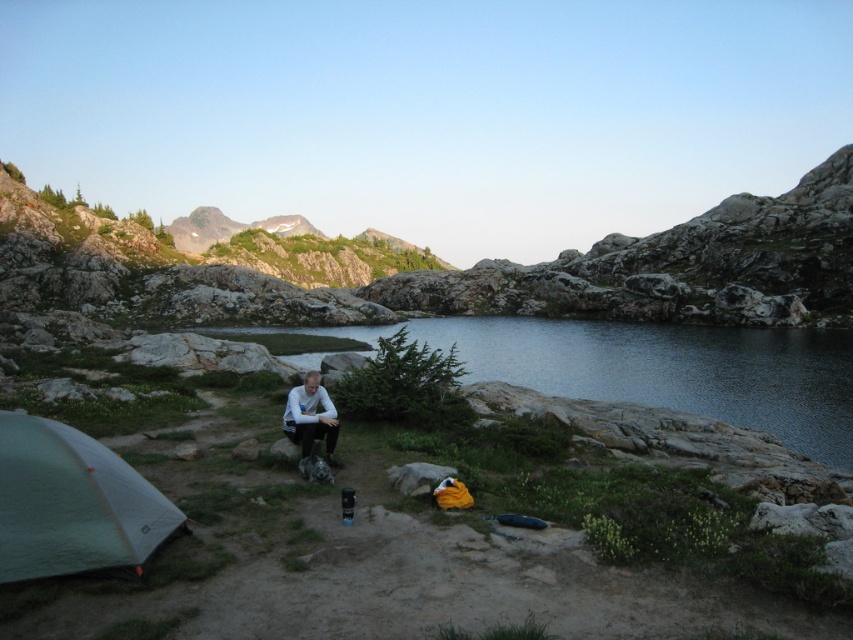
You are a hiker who needs to refill your water bottle. You see the clear water at center and the green fabric tent at lower left. Which one is located to the right of the other?

The clear water at center is to the right of the green fabric tent at lower left.

You are standing in the camping scene and want to place a small item between the two points marked as point [386,333] and point [311,424]. Which point should the item be closer to in order to be closer to the viewer?

The item should be closer to point [386,333] because it is further to the viewer than point [311,424].

You are a hiker who needs to know if the clear water at center is higher than the white matte shirt at center. Can you confirm this?

The clear water at center has a greater height compared to the white matte shirt at center, so yes, the clear water at center is higher than the white matte shirt at center.